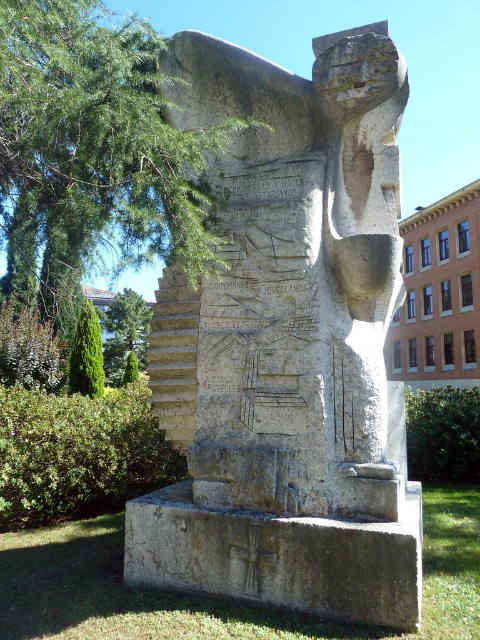
Question: Does green leafy tree at upper left have a larger size compared to green leafy tree at left?

Choices:
 (A) yes
 (B) no

Answer: (A)

Question: Which point is farther from the camera taking this photo?

Choices:
 (A) (132, 340)
 (B) (98, 232)
 (C) (313, 598)

Answer: (A)

Question: Can you confirm if green leafy tree at upper left is smaller than green leafy tree at left?

Choices:
 (A) yes
 (B) no

Answer: (B)

Question: Which point is closer to the camera?

Choices:
 (A) green leafy tree at lower left
 (B) green leafy tree at upper left
 (C) green leafy tree at left
 (D) gray stone monument at center

Answer: (B)

Question: Which point appears closest to the camera in this image?

Choices:
 (A) (82, 376)
 (B) (113, 360)
 (C) (369, 67)
 (D) (172, 221)

Answer: (D)

Question: Is green leafy tree at left to the right of green leafy tree at lower left from the viewer's perspective?

Choices:
 (A) no
 (B) yes

Answer: (A)